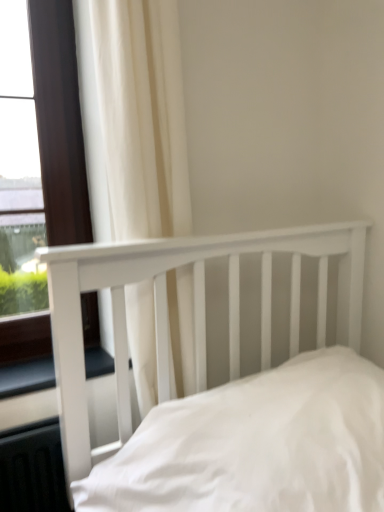
The width and height of the screenshot is (384, 512). In order to click on white wooden bed at center in this screenshot , I will do `click(194, 310)`.

What do you see at coordinates (194, 310) in the screenshot?
I see `white wooden bed at center` at bounding box center [194, 310].

This screenshot has height=512, width=384. I want to click on black rubber window sill at lower left, so click(x=102, y=402).

Who is smaller, black rubber window sill at lower left or white fabric curtain at upper left?

With smaller size is black rubber window sill at lower left.

Where is `window sill below the white fabric curtain at upper left (from the image's perspective)`? Image resolution: width=384 pixels, height=512 pixels. window sill below the white fabric curtain at upper left (from the image's perspective) is located at coordinates (102, 402).

Does black rubber window sill at lower left have a lesser width compared to white fabric curtain at upper left?

In fact, black rubber window sill at lower left might be wider than white fabric curtain at upper left.

Considering the points (19, 415) and (114, 39), which point is in front, point (19, 415) or point (114, 39)?

The point (114, 39) is closer to the camera.

Would you say white wooden bed at center is a long distance from black rubber window sill at lower left?

No, there isn't a large distance between white wooden bed at center and black rubber window sill at lower left.

This screenshot has height=512, width=384. Find the location of `bed above the black rubber window sill at lower left (from a real-world perspective)`. bed above the black rubber window sill at lower left (from a real-world perspective) is located at coordinates (194, 310).

From a real-world perspective, is white wooden bed at center on black rubber window sill at lower left?

Correct, in the physical world, white wooden bed at center is higher than black rubber window sill at lower left.

Is white fabric curtain at upper left behind matte brown window at left?

No, it is not.

Does white fabric curtain at upper left touch matte brown window at left?

No, white fabric curtain at upper left is not with matte brown window at left.

Is white fabric curtain at upper left not within matte brown window at left?

Yes, white fabric curtain at upper left is not within matte brown window at left.

Considering the sizes of objects white fabric curtain at upper left and black rubber window sill at lower left in the image provided, who is wider, white fabric curtain at upper left or black rubber window sill at lower left?

black rubber window sill at lower left is wider.

I want to click on window sill that appears below the white fabric curtain at upper left (from a real-world perspective), so click(102, 402).

Is white fabric curtain at upper left smaller than black rubber window sill at lower left?

Actually, white fabric curtain at upper left might be larger than black rubber window sill at lower left.

Considering the relative positions of white fabric curtain at upper left and black rubber window sill at lower left in the image provided, is white fabric curtain at upper left to the right of black rubber window sill at lower left from the viewer's perspective?

Yes.

Who is bigger, matte brown window at left or white wooden bed at center?

Bigger between the two is white wooden bed at center.

From a real-world perspective, is matte brown window at left located beneath white wooden bed at center?

Incorrect, from a real-world perspective, matte brown window at left is higher than white wooden bed at center.

In the scene shown: Does matte brown window at left have a greater height compared to white wooden bed at center?

Yes.

Considering the points (87, 203) and (213, 274), which point is behind, point (87, 203) or point (213, 274)?

The point (213, 274) is more distant.

How many degrees apart are the facing directions of black rubber window sill at lower left and white wooden bed at center?

0.155 degrees separate the facing orientations of black rubber window sill at lower left and white wooden bed at center.

Is black rubber window sill at lower left facing away from white wooden bed at center?

No, black rubber window sill at lower left is not facing the opposite direction of white wooden bed at center.

Considering the positions of objects black rubber window sill at lower left and white wooden bed at center in the image provided, who is more to the left, black rubber window sill at lower left or white wooden bed at center?

black rubber window sill at lower left.

Measure the distance from black rubber window sill at lower left to white wooden bed at center.

black rubber window sill at lower left and white wooden bed at center are 11.91 inches apart from each other.

From the image's perspective, is black rubber window sill at lower left located beneath matte brown window at left?

Yes, from the image's perspective, black rubber window sill at lower left is below matte brown window at left.

Is black rubber window sill at lower left aimed at matte brown window at left?

No, black rubber window sill at lower left is not oriented towards matte brown window at left.

Looking at this image, from a real-world perspective, who is located higher, black rubber window sill at lower left or matte brown window at left?

matte brown window at left.

This screenshot has width=384, height=512. Identify the location of curtain lying on the right of black rubber window sill at lower left. coord(134,116).

Locate an element on the screen. Image resolution: width=384 pixels, height=512 pixels. bed above the black rubber window sill at lower left (from the image's perspective) is located at coordinates (194, 310).

Based on their spatial positions, is white wooden bed at center or white fabric curtain at upper left closer to black rubber window sill at lower left?

white wooden bed at center is positioned closer to the anchor black rubber window sill at lower left.

Looking at this image, when comparing their distances from white wooden bed at center, does black rubber window sill at lower left or white fabric curtain at upper left seem closer?

white fabric curtain at upper left lies closer to white wooden bed at center than the other object.

Based on the photo, when comparing their distances from white fabric curtain at upper left, does matte brown window at left or white wooden bed at center seem further?

The object further to white fabric curtain at upper left is matte brown window at left.

Based on their spatial positions, is matte brown window at left or black rubber window sill at lower left closer to white fabric curtain at upper left?

Among the two, matte brown window at left is located nearer to white fabric curtain at upper left.

When comparing their distances from white wooden bed at center, does white fabric curtain at upper left or matte brown window at left seem closer?

white fabric curtain at upper left.

Considering their positions, is matte brown window at left positioned closer to white wooden bed at center than white fabric curtain at upper left?

white fabric curtain at upper left is closer to white wooden bed at center.

Looking at the image, which one is located closer to white fabric curtain at upper left, black rubber window sill at lower left or white wooden bed at center?

white wooden bed at center is positioned closer to the anchor white fabric curtain at upper left.

Estimate the real-world distances between objects in this image. Which object is closer to white fabric curtain at upper left, black rubber window sill at lower left or matte brown window at left?

Based on the image, matte brown window at left appears to be nearer to white fabric curtain at upper left.

I want to click on window sill located between white wooden bed at center and matte brown window at left in the depth direction, so click(102, 402).

Where is `curtain between white wooden bed at center and matte brown window at left along the z-axis`? curtain between white wooden bed at center and matte brown window at left along the z-axis is located at coordinates (134, 116).

Where is `curtain between white wooden bed at center and black rubber window sill at lower left along the z-axis`? The width and height of the screenshot is (384, 512). curtain between white wooden bed at center and black rubber window sill at lower left along the z-axis is located at coordinates (134, 116).

What are the coordinates of `curtain that lies between matte brown window at left and black rubber window sill at lower left from top to bottom` in the screenshot? It's located at (134, 116).